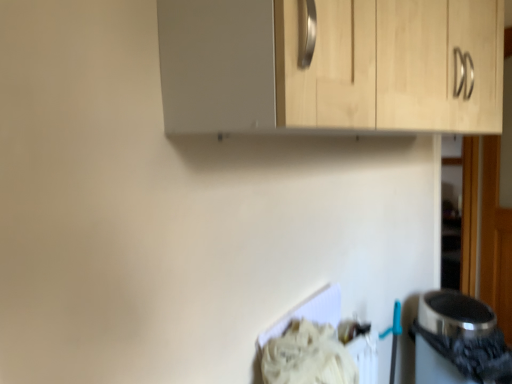
This screenshot has width=512, height=384. What do you see at coordinates (331, 65) in the screenshot? I see `matte wood cabinet at upper center` at bounding box center [331, 65].

Find the location of a particular element. This screenshot has width=512, height=384. matte wood cabinet at upper center is located at coordinates (331, 65).

Where is `matte wood cabinet at upper center`? This screenshot has height=384, width=512. matte wood cabinet at upper center is located at coordinates (331, 65).